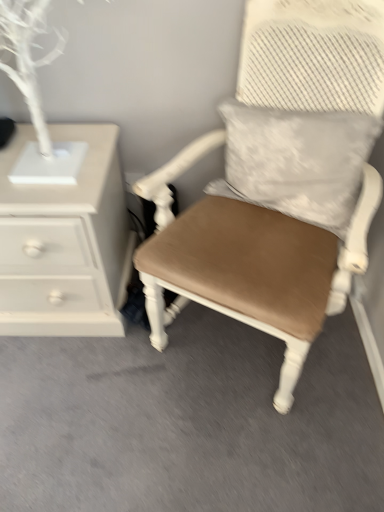
You are a GUI agent. You are given a task and a screenshot of the screen. Output one action in this format:
    pyautogui.click(x=<x>, y=<y>)
    Task: Click on the free spot in front of white painted wood chest of drawers at left
    The height and width of the screenshot is (512, 384).
    Given the screenshot: What is the action you would take?
    pyautogui.click(x=74, y=401)